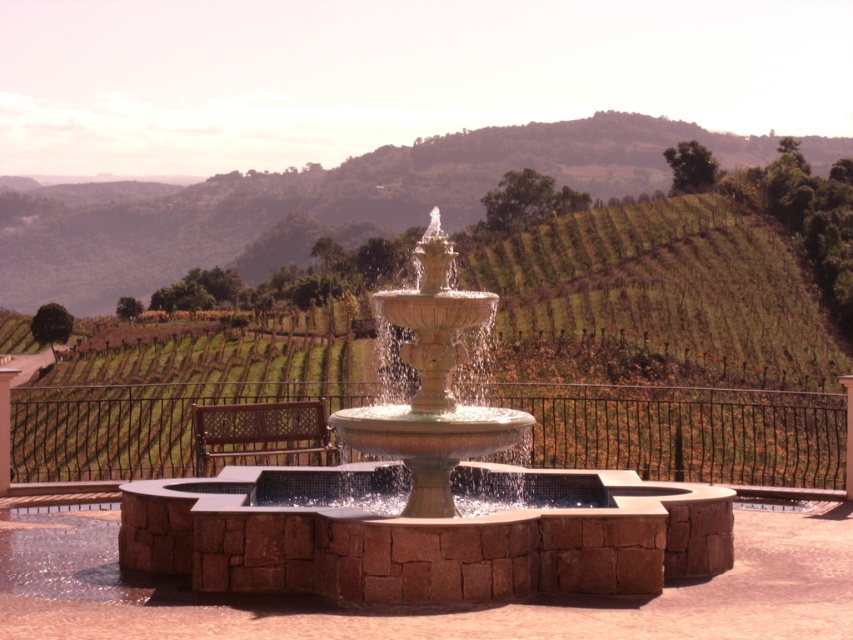
You are standing at the base of the fountain and want to take a photo of the green grassy hillside at upper center. If your camera has a maximum focus range of 400 feet, will it be able to capture the hillside clearly?

The green grassy hillside at upper center and camera are 395.95 feet apart, which is within the camera maximum focus range of 400 feet. So yes, the camera can capture the green grassy hillside at upper center clearly.